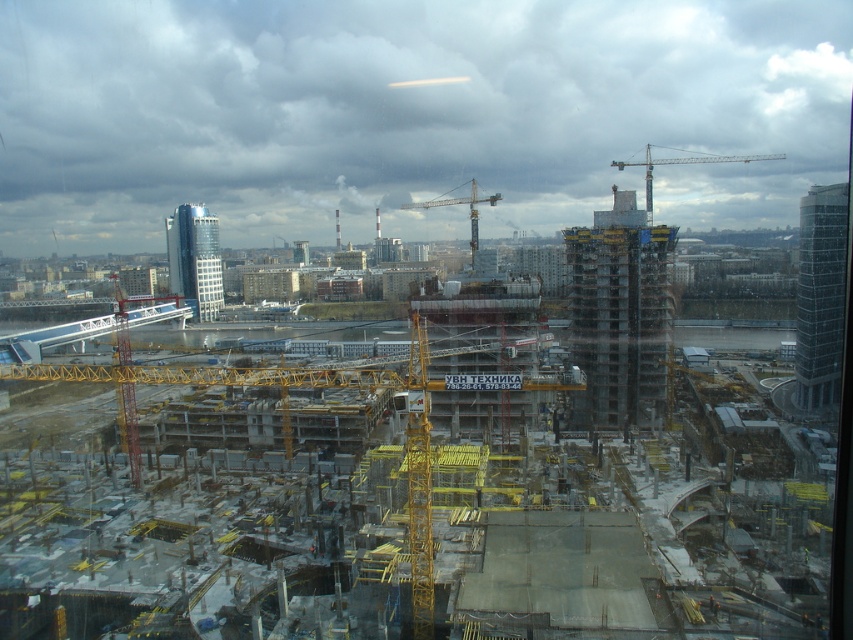
You are a construction worker who needs to move a heavy beam from the yellow metallic crane at upper center to the yellow metallic crane at center. Given that the maximum distance your crane can safely operate is 90 meters, can you safely transfer the beam between the two cranes?

The yellow metallic crane at upper center and yellow metallic crane at center are 91.08 meters apart. Since the maximum safe operating distance is 90 meters, transferring the beam between them would exceed the safe limit, making it unsafe.

Based on the photo, you are a construction worker who needs to move a heavy equipment from the right side to the left side of the image. The path between the concrete at center and the yellow metallic crane at center is narrow. Can you pass through this path with your equipment?

The concrete at center is bigger than the yellow metallic crane at center, so the path between them might be too narrow for heavy equipment to pass through safely. Consider an alternative route.

You are a construction worker standing at the center of the construction site. You see two points marked on the ground at point coordinates point (10,500) and point (630,161). Which point is closer to you?

Point (10,500) is closer to the viewer than point (630,161), so the point at coordinates point (10,500) is closer to you.